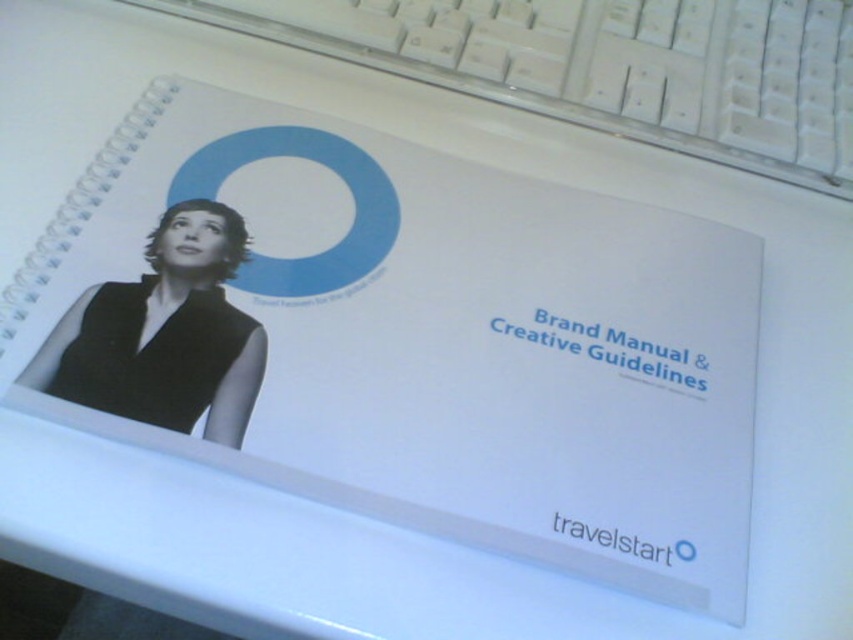
Can you confirm if white plastic keyboard at upper center is smaller than black matte/vinyl photo at left?

Incorrect, white plastic keyboard at upper center is not smaller in size than black matte/vinyl photo at left.

What do you see at coordinates (608, 65) in the screenshot? This screenshot has width=853, height=640. I see `white plastic keyboard at upper center` at bounding box center [608, 65].

Find the location of a particular element. The width and height of the screenshot is (853, 640). white plastic keyboard at upper center is located at coordinates (608, 65).